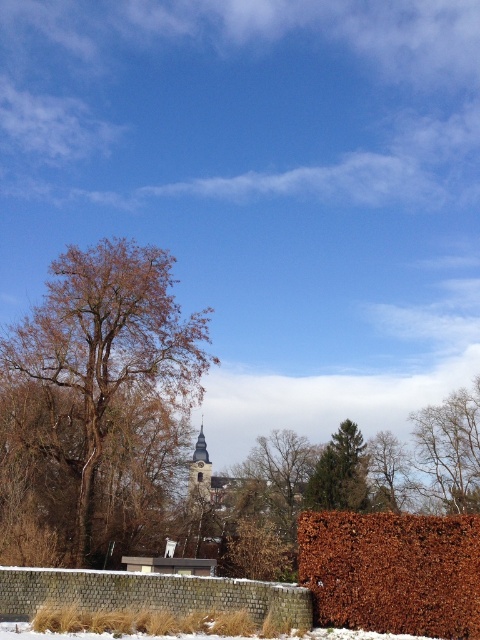
Question: Is brown rough bark tree at left smaller than bare branches at upper right?

Choices:
 (A) no
 (B) yes

Answer: (A)

Question: Which object appears closest to the camera in this image?

Choices:
 (A) brown rough bark tree at left
 (B) bare branches at upper right

Answer: (A)

Question: Does green needle-like tree at center come in front of brown leafy tree at center?

Choices:
 (A) no
 (B) yes

Answer: (B)

Question: Which point is closer to the camera?

Choices:
 (A) (464, 500)
 (B) (282, 484)
 (C) (410, 588)
 (D) (68, 284)

Answer: (C)

Question: Where is bare branches at upper right located in relation to green needle-like tree at center in the image?

Choices:
 (A) above
 (B) below

Answer: (A)

Question: Which of the following is the farthest from the observer?

Choices:
 (A) (343, 570)
 (B) (314, 465)
 (C) (381, 468)

Answer: (B)